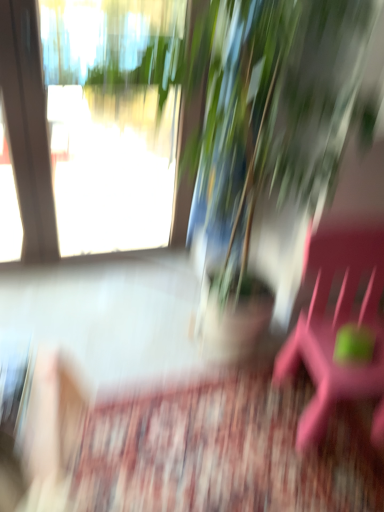
Describe the element at coordinates (271, 142) in the screenshot. I see `green leafy plant at upper center` at that location.

Where is `green leafy plant at upper center`? The image size is (384, 512). green leafy plant at upper center is located at coordinates (271, 142).

Describe the element at coordinates (337, 328) in the screenshot. I see `pink plastic beach chair at right` at that location.

Where is `pink plastic beach chair at right`? The width and height of the screenshot is (384, 512). pink plastic beach chair at right is located at coordinates (337, 328).

Locate an element on the screen. Image resolution: width=384 pixels, height=512 pixels. green leafy plant at upper center is located at coordinates (271, 142).

Is pink plastic beach chair at right at the left side of green leafy plant at upper center?

No, pink plastic beach chair at right is not to the left of green leafy plant at upper center.

In the image, is pink plastic beach chair at right positioned in front of or behind green leafy plant at upper center?

pink plastic beach chair at right is in front of green leafy plant at upper center.

Is point (381, 332) closer to viewer compared to point (266, 102)?

No, it is behind (266, 102).

From the image's perspective, is pink plastic beach chair at right over green leafy plant at upper center?

No.

From a real-world perspective, which is physically above, pink plastic beach chair at right or green leafy plant at upper center?

green leafy plant at upper center is physically above.

Between pink plastic beach chair at right and green leafy plant at upper center, which one has larger width?

With larger width is pink plastic beach chair at right.

Is pink plastic beach chair at right taller or shorter than green leafy plant at upper center?

Considering their sizes, pink plastic beach chair at right has less height than green leafy plant at upper center.

Who is smaller, pink plastic beach chair at right or green leafy plant at upper center?

With smaller size is pink plastic beach chair at right.

Based on the photo, is pink plastic beach chair at right spatially inside green leafy plant at upper center, or outside of it?

pink plastic beach chair at right is spatially situated outside green leafy plant at upper center.

In the scene shown: Is pink plastic beach chair at right not close to green leafy plant at upper center?

No, pink plastic beach chair at right is not far from green leafy plant at upper center.

Is pink plastic beach chair at right facing away from green leafy plant at upper center?

That's not correct — pink plastic beach chair at right is not looking away from green leafy plant at upper center.

How many degrees apart are the facing directions of pink plastic beach chair at right and green leafy plant at upper center?

11.1 degrees.

How distant is pink plastic beach chair at right from green leafy plant at upper center?

The distance of pink plastic beach chair at right from green leafy plant at upper center is 12.90 inches.

Where is `houseplant to the left of pink plastic beach chair at right`? The height and width of the screenshot is (512, 384). houseplant to the left of pink plastic beach chair at right is located at coordinates (271, 142).

Which object is positioned more to the right, green leafy plant at upper center or pink plastic beach chair at right?

pink plastic beach chair at right.

In the scene shown: Which object is further away from the camera taking this photo, green leafy plant at upper center or pink plastic beach chair at right?

green leafy plant at upper center.

Does point (294, 168) appear closer or farther from the camera than point (283, 350)?

Point (294, 168).

From the image's perspective, who appears lower, green leafy plant at upper center or pink plastic beach chair at right?

pink plastic beach chair at right, from the image's perspective.

From a real-world perspective, is green leafy plant at upper center positioned above or below pink plastic beach chair at right?

green leafy plant at upper center is situated higher than pink plastic beach chair at right in the real world.

Is green leafy plant at upper center wider or thinner than pink plastic beach chair at right?

Clearly, green leafy plant at upper center has less width compared to pink plastic beach chair at right.

Which of these two, green leafy plant at upper center or pink plastic beach chair at right, stands taller?

With more height is green leafy plant at upper center.

Who is smaller, green leafy plant at upper center or pink plastic beach chair at right?

pink plastic beach chair at right is smaller.

Is green leafy plant at upper center outside of pink plastic beach chair at right?

Yes, green leafy plant at upper center is outside of pink plastic beach chair at right.

Is green leafy plant at upper center next to pink plastic beach chair at right and touching it?

No, green leafy plant at upper center is not next to pink plastic beach chair at right.

Is green leafy plant at upper center positioned with its back to pink plastic beach chair at right?

No, pink plastic beach chair at right is not at the back of green leafy plant at upper center.

How different are the orientations of green leafy plant at upper center and pink plastic beach chair at right in degrees?

green leafy plant at upper center and pink plastic beach chair at right are facing 11.1 degrees away from each other.

At what (x,y) coordinates should I click in order to perform the action: click on houseplant that appears behind the pink plastic beach chair at right. Please return your answer as a coordinate pair (x, y). The height and width of the screenshot is (512, 384). Looking at the image, I should click on (271, 142).

What are the coordinates of `houseplant on the left of pink plastic beach chair at right` in the screenshot? It's located at (271, 142).

Locate an element on the screen. This screenshot has width=384, height=512. beach chair in front of the green leafy plant at upper center is located at coordinates (337, 328).